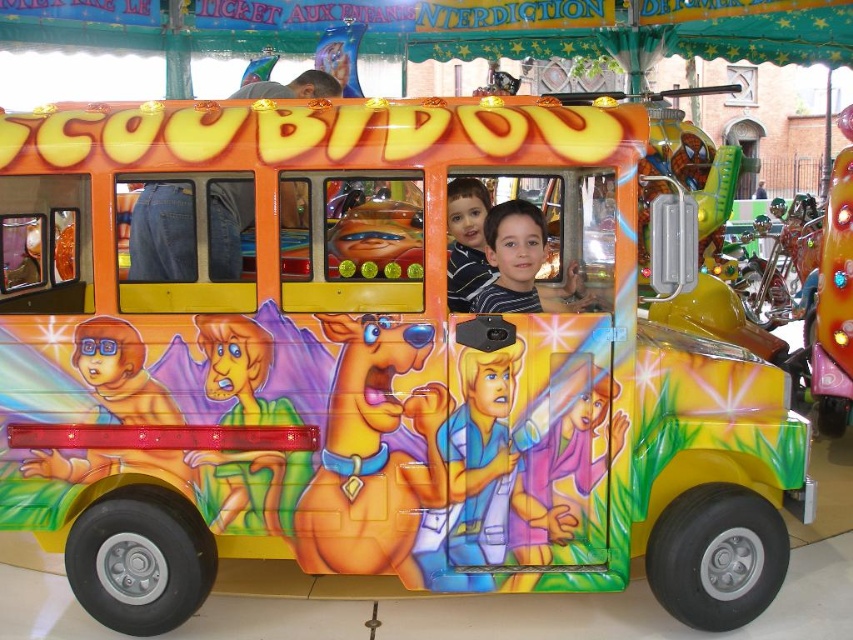
Who is positioned more to the right, striped shirt at center or matte striped shirt at center?

striped shirt at center

Looking at this image, which of these two, striped shirt at center or matte striped shirt at center, stands taller?

With more height is matte striped shirt at center.

Who is more distant from viewer, (514, 253) or (488, 275)?

Point (488, 275)

The height and width of the screenshot is (640, 853). I want to click on striped shirt at center, so (519, 262).